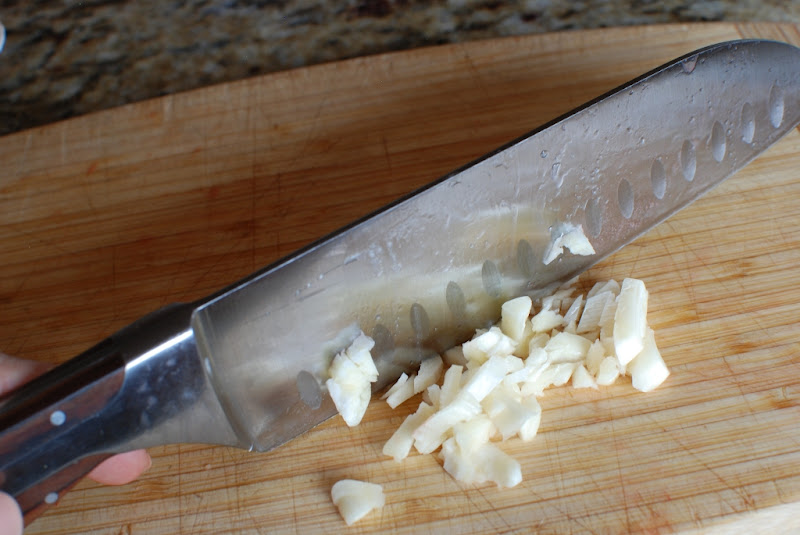
Where is `wood grain going horizontally`? This screenshot has width=800, height=535. wood grain going horizontally is located at coordinates (294, 141), (710, 281), (548, 499).